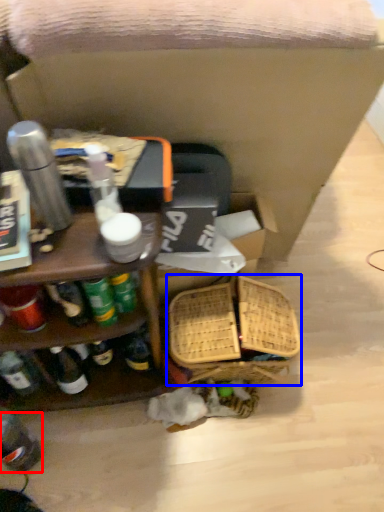
Question: Which point is further to the camera, bottle (highlighted by a red box) or basket (highlighted by a blue box)?

Choices:
 (A) bottle
 (B) basket

Answer: (B)